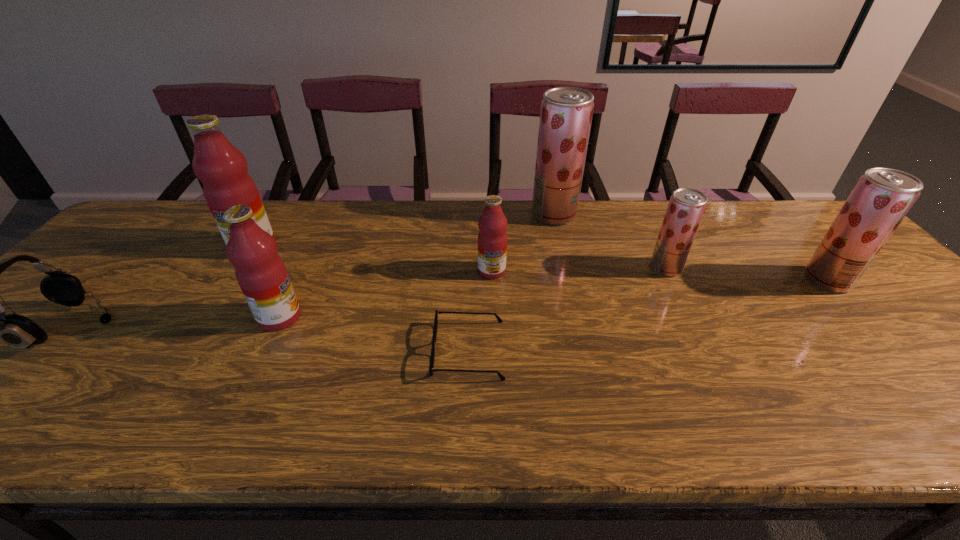
Locate an element on the screen. the biggest strawberry fruit juice is located at coordinates (566, 113).

Find the location of a particular element. The image size is (960, 540). the farthest fruit juice is located at coordinates (566, 113).

Image resolution: width=960 pixels, height=540 pixels. I want to click on the leftmost pink fruit juice, so coord(222,168).

You are a GUI agent. You are given a task and a screenshot of the screen. Output one action in this format:
    pyautogui.click(x=<x>, y=<y>)
    Task: Click on the farthest pink fruit juice
    Image resolution: width=960 pixels, height=540 pixels.
    Given the screenshot: What is the action you would take?
    pyautogui.click(x=222, y=168)

The image size is (960, 540). I want to click on the second smallest strawberry fruit juice, so click(882, 197).

Find the location of `the rightmost object`. the rightmost object is located at coordinates (882, 197).

This screenshot has height=540, width=960. I want to click on the fifth fruit juice from right to left, so (x=261, y=273).

This screenshot has height=540, width=960. Identify the location of the nearest fruit juice. (261, 273).

The image size is (960, 540). Identify the location of the seventh object from left to right. (686, 207).

Where is `the fifth fruit juice from left to right`? the fifth fruit juice from left to right is located at coordinates (686, 207).